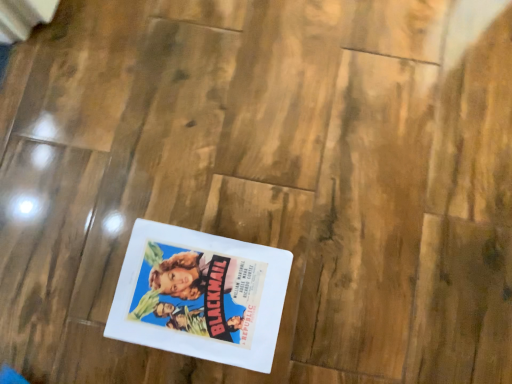
The image size is (512, 384). In order to click on vacant area on the back side of white paper at center in this screenshot , I will do `click(203, 169)`.